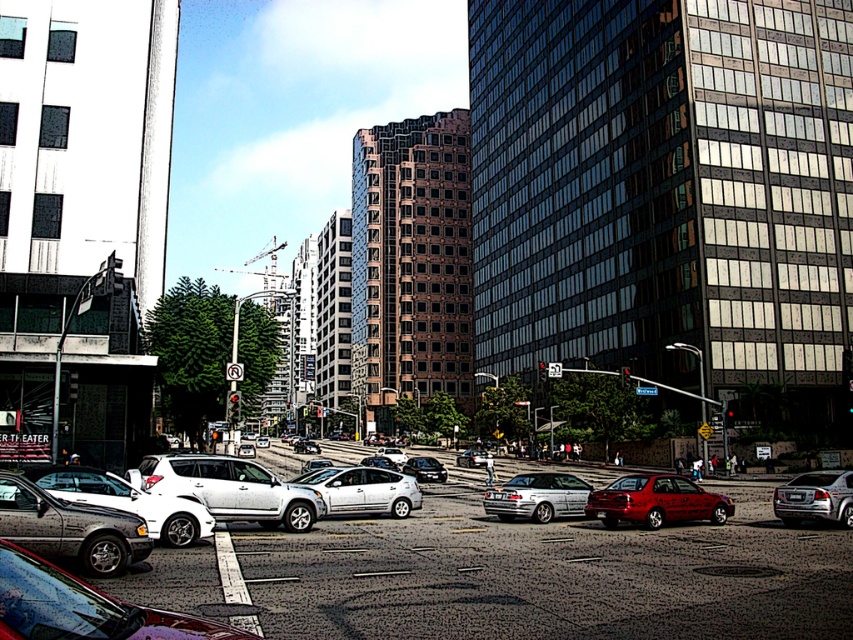
Question: Observing the image, what is the correct spatial positioning of white matte suv at center in reference to metallic silver sedan at center?

Choices:
 (A) above
 (B) below

Answer: (A)

Question: Which point is closer to the camera?

Choices:
 (A) white matte suv at center
 (B) silver metallic sedan at lower left

Answer: (B)

Question: Does shiny red sedan at center have a larger size compared to satin silver car at center?

Choices:
 (A) no
 (B) yes

Answer: (A)

Question: Estimate the real-world distances between objects in this image. Which object is farther from the metallic silver sedan at center?

Choices:
 (A) shiny black sedan at center
 (B) satin silver sedan at center
 (C) white matte suv at center

Answer: (A)

Question: Estimate the real-world distances between objects in this image. Which object is farther from the satin silver sedan at center?

Choices:
 (A) satin silver car at center
 (B) shiny red sedan at center
 (C) silver metallic sedan at lower left
 (D) shiny silver sedan at center

Answer: (D)

Question: Is shiny black sedan at center further to the viewer compared to satin silver car at center?

Choices:
 (A) no
 (B) yes

Answer: (A)